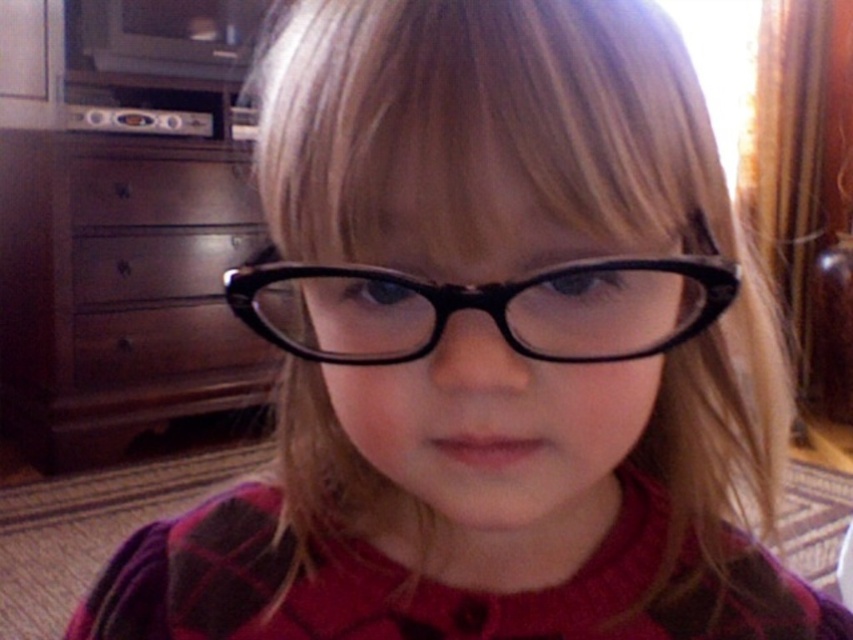
Question: Which object is positioned farthest from the black plastic glasses at center?

Choices:
 (A) brown wood dresser at left
 (B) satin silver drawer at center
 (C) brushed metal drawer at center

Answer: (A)

Question: Which point is closer to the camera taking this photo?

Choices:
 (A) (149, 298)
 (B) (115, 337)
 (C) (691, 323)
 (D) (206, 316)

Answer: (C)

Question: Which object is closer to the camera taking this photo?

Choices:
 (A) black plastic glasses at center
 (B) brushed metal drawer at center
 (C) brown wood dresser at left

Answer: (A)

Question: Where is brown wood dresser at left located in relation to brushed metal drawer at center in the image?

Choices:
 (A) left
 (B) right

Answer: (A)

Question: Does brown wood drawer at center lie behind satin silver drawer at center?

Choices:
 (A) yes
 (B) no

Answer: (A)

Question: Is satin silver drawer at center bigger than brushed metal drawer at center?

Choices:
 (A) no
 (B) yes

Answer: (B)